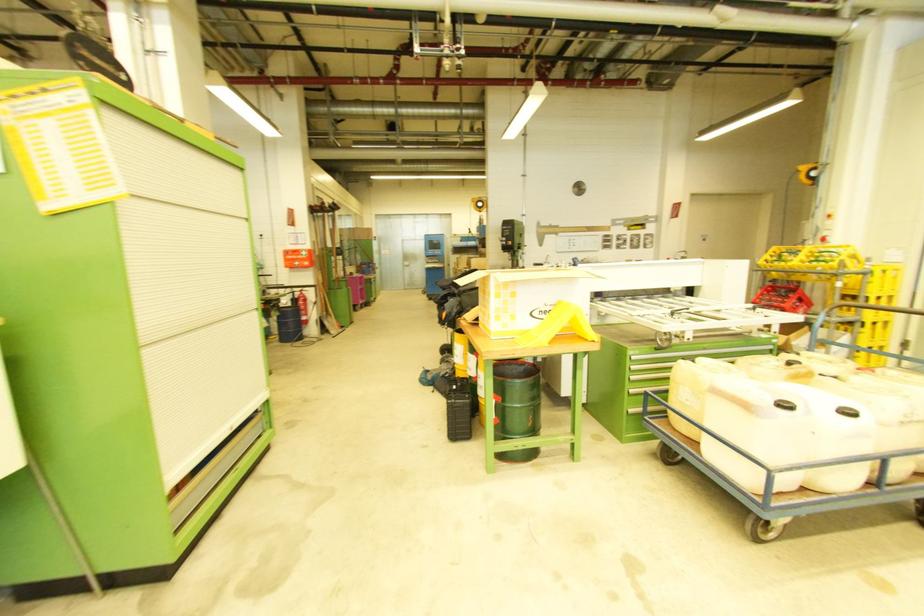
The width and height of the screenshot is (924, 616). Identify the location of black case handle. (458, 419).